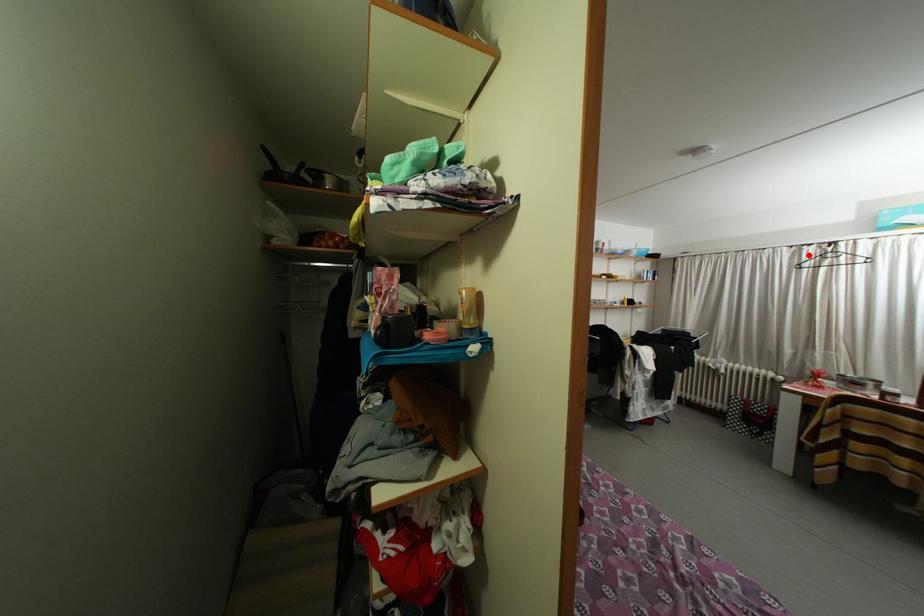
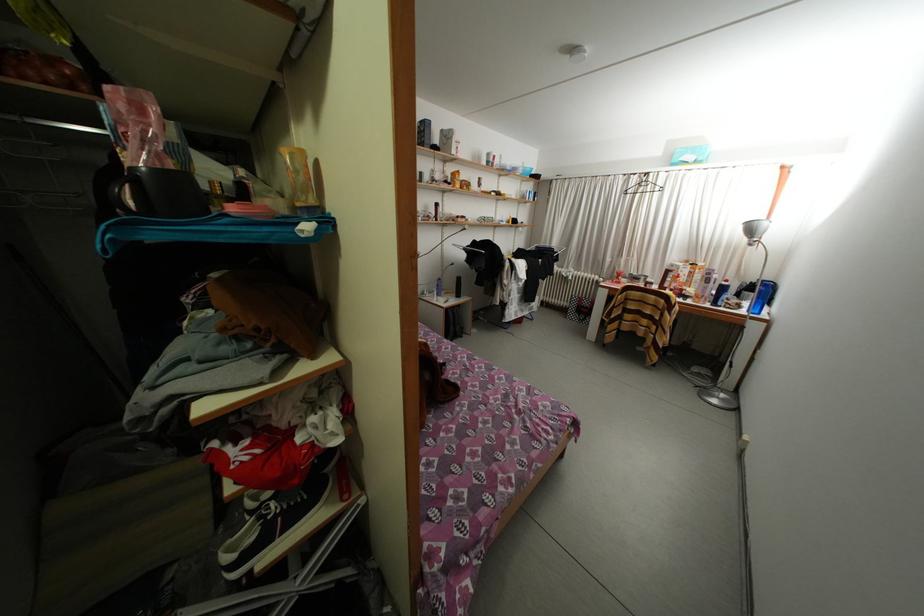
Locate, in the second image, the point that corresponds to the highlighted location in the first image.

(638, 184)